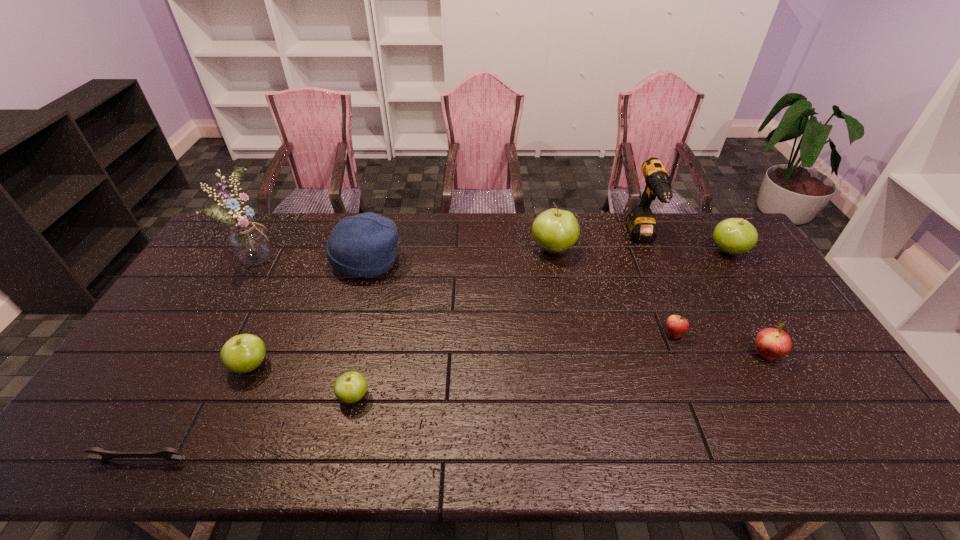
Locate an element on the screen. the leftmost apple is located at coordinates (243, 353).

Where is `the bigger red apple`? the bigger red apple is located at coordinates (771, 343).

Identify the location of the right red apple. The width and height of the screenshot is (960, 540). (771, 343).

Identify the location of the left red apple. (676, 325).

In order to click on the third apple from right to left in this screenshot , I will do `click(676, 325)`.

The height and width of the screenshot is (540, 960). In order to click on the smallest green apple in this screenshot , I will do `click(350, 387)`.

Identify the location of the second apple from left to right. (350, 387).

In order to click on the nearest object in this screenshot , I will do `click(166, 453)`.

I want to click on the shortest object, so click(166, 453).

Image resolution: width=960 pixels, height=540 pixels. What are the coordinates of `free region located 0.250m on the front-facing side of the green bouquet` in the screenshot? It's located at (351, 256).